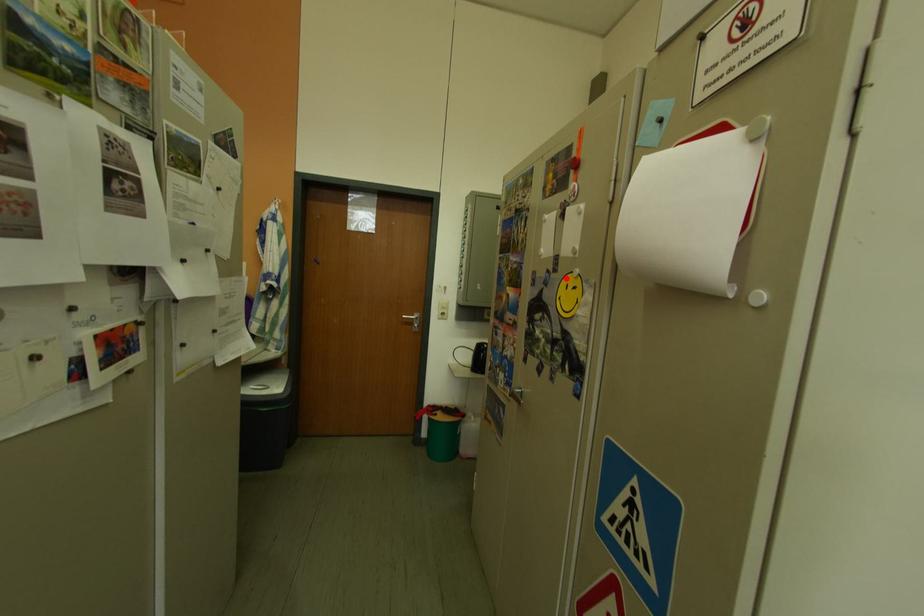
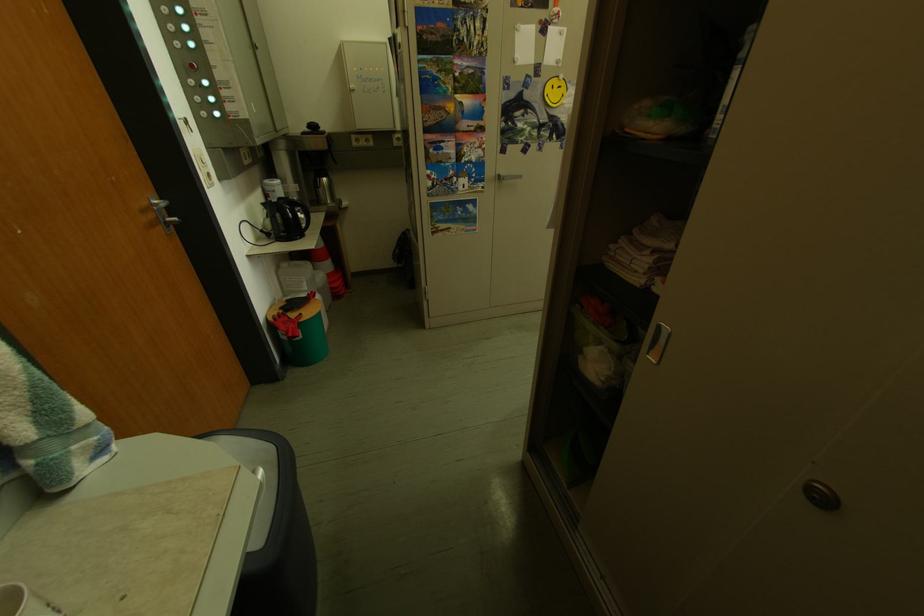
Find the pixel in the second image that matches the highlighted location in the first image.

(546, 82)